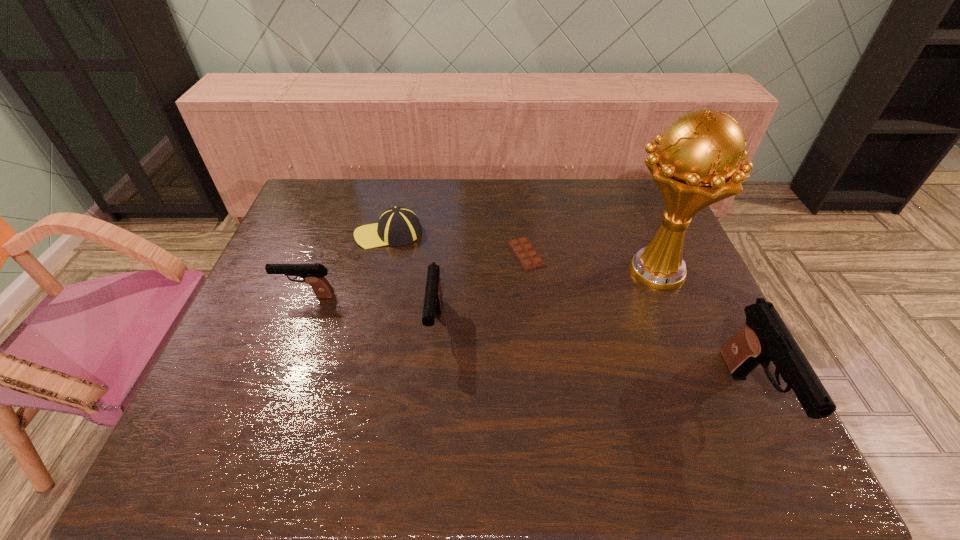
The width and height of the screenshot is (960, 540). I want to click on the leftmost pistol, so click(x=313, y=274).

Locate an element on the screen. The image size is (960, 540). the fourth tallest object is located at coordinates (313, 274).

Locate an element on the screen. the second shortest pistol is located at coordinates (432, 306).

Locate an element on the screen. the second pistol from left to right is located at coordinates (432, 306).

You are a GUI agent. You are given a task and a screenshot of the screen. Output one action in this format:
    pyautogui.click(x=<x>, y=<y>)
    Task: Click on the rightmost pistol
    The width and height of the screenshot is (960, 540).
    Given the screenshot: What is the action you would take?
    pyautogui.click(x=765, y=337)

Find the location of a particular element. The height and width of the screenshot is (540, 960). the second tallest object is located at coordinates (765, 337).

Where is `trophy_cup`? trophy_cup is located at coordinates (696, 164).

This screenshot has width=960, height=540. I want to click on the second object from left to right, so click(397, 226).

Identify the location of baseball cap. The width and height of the screenshot is (960, 540). coord(397,226).

The height and width of the screenshot is (540, 960). I want to click on the fourth object from left to right, so click(528, 257).